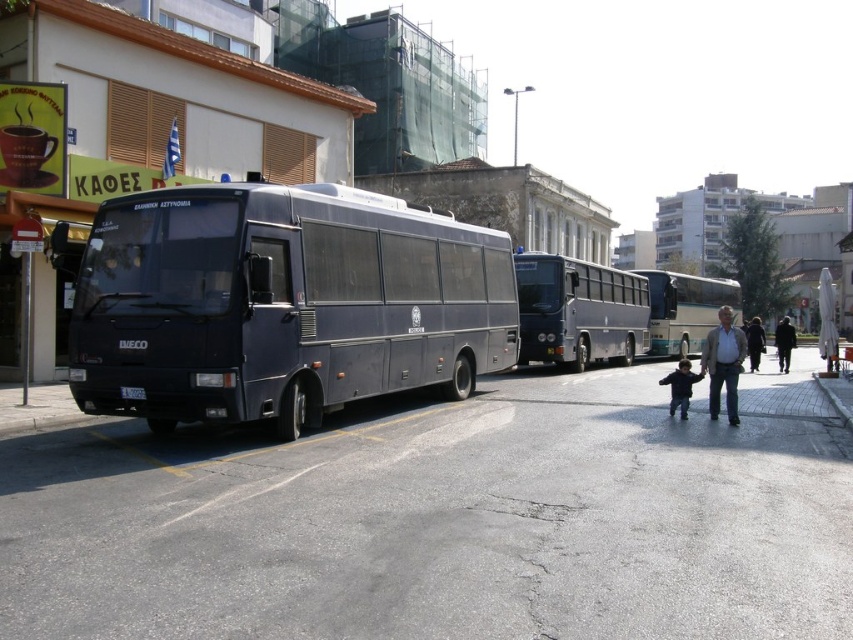
You are a delivery person trying to park your van near the metallic silver bus at center and the dark blue jacket at center. Since you need to leave enough space for the jacket wearer to pass, which object should you park closer to?

The metallic silver bus at center is bigger than the dark blue jacket at center, so you should park closer to the dark blue jacket at center to leave more space for the jacket wearer to pass safely.

You are a delivery person standing at the bus stop and need to cross the street to deliver a package to the address on the other side. The street is 22 meters wide. Can you safely cross the street from the metallic bus stop at left without needing to go to another crossing?

The metallic bus stop at left is 13.84 meters away from the viewer. Since the street is 22 meters wide, the distance from the bus stop to the other side would be 22 meters minus the distance from the viewer to the bus stop. However, without knowing the exact position of the viewer relative to the bus stop and the street width, it is impossible to determine if the metallic bus stop at left allows safe crossing directly. The information provided is insufficient to confirm safety.